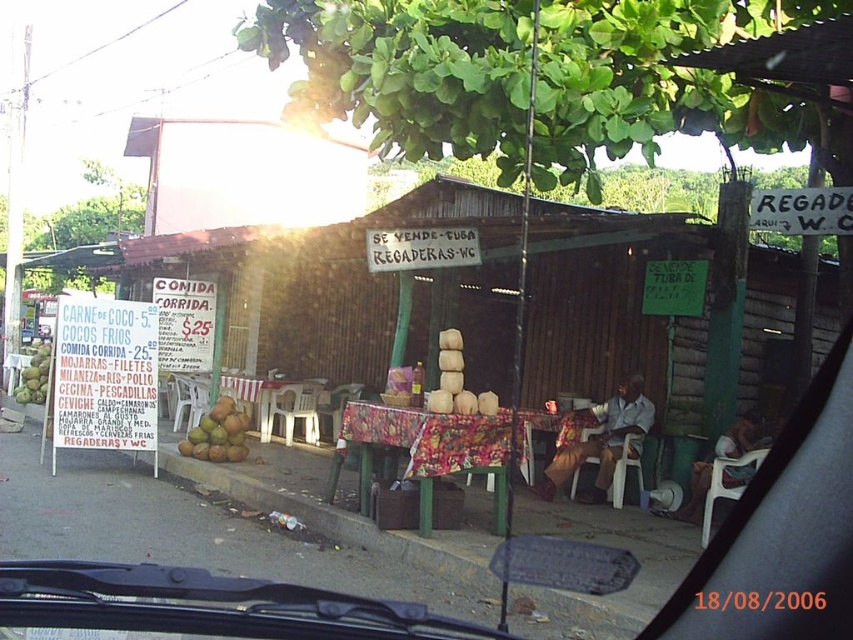
The height and width of the screenshot is (640, 853). In order to click on floral fabric-covered table at center in this screenshot , I will do `click(426, 451)`.

In order to click on floral fabric-covered table at center in this screenshot , I will do `click(426, 451)`.

Who is positioned more to the left, transparent rubber windshield at center or green matte coconuts at center?

green matte coconuts at center is more to the left.

Is transparent rubber windshield at center below green matte coconuts at center?

No, transparent rubber windshield at center is not below green matte coconuts at center.

Identify the location of transparent rubber windshield at center. (206, 608).

Does green matte coconuts at center come behind green coconut at left?

No, green matte coconuts at center is closer to the viewer.

Does point (238, 413) come behind point (44, 369)?

No, (238, 413) is in front of (44, 369).

Find the location of a particular element. green matte coconuts at center is located at coordinates (218, 433).